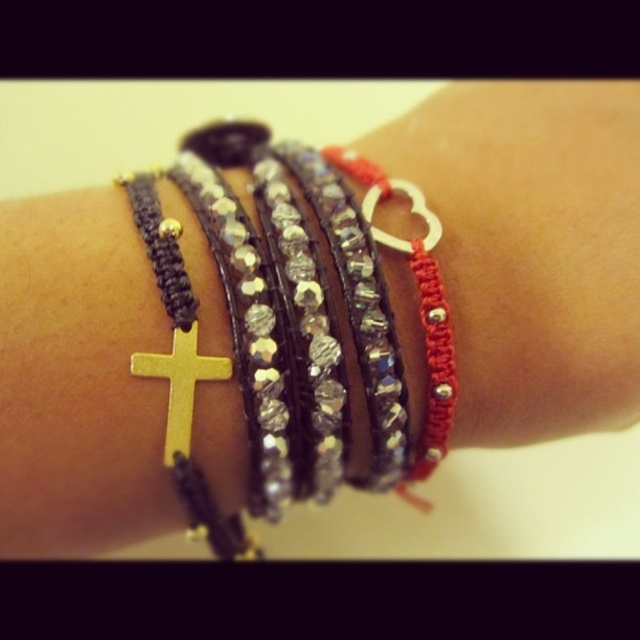
Question: Does red beaded heart at center come in front of gold metallic cross at center?

Choices:
 (A) yes
 (B) no

Answer: (B)

Question: Can you confirm if red beaded heart at center is wider than gold metallic cross at center?

Choices:
 (A) no
 (B) yes

Answer: (B)

Question: Is red beaded heart at center smaller than gold metallic cross at center?

Choices:
 (A) no
 (B) yes

Answer: (A)